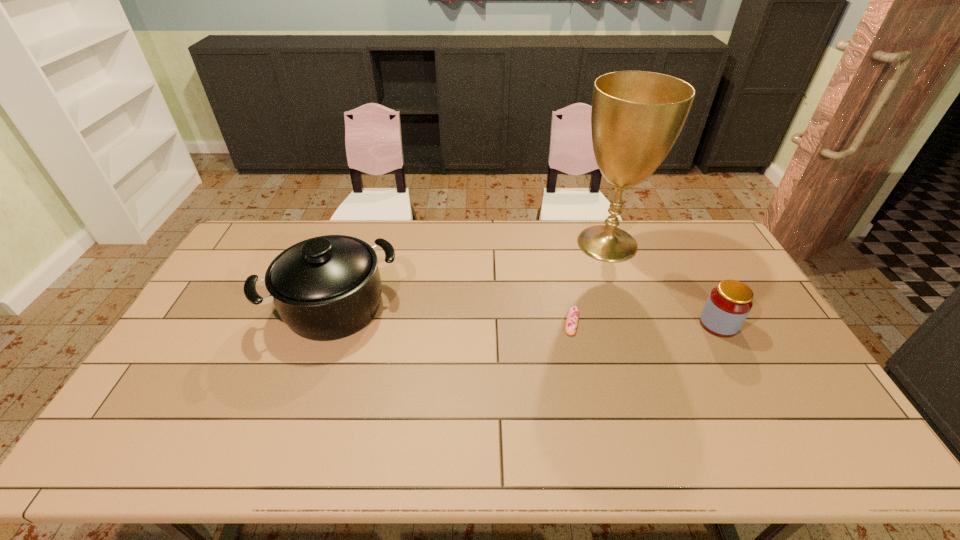
You are a GUI agent. You are given a task and a screenshot of the screen. Output one action in this format:
    pyautogui.click(x=<x>, y=<y>)
    Task: Click on the second object from right to left
    Image resolution: width=960 pixels, height=540 pixels.
    Given the screenshot: What is the action you would take?
    pyautogui.click(x=636, y=117)

Find the location of a particular element. the farthest object is located at coordinates click(636, 117).

The height and width of the screenshot is (540, 960). What are the coordinates of `the leftmost object` in the screenshot? It's located at (325, 288).

The height and width of the screenshot is (540, 960). I want to click on saucepan, so click(325, 288).

Locate an element on the screen. the third tallest object is located at coordinates (729, 303).

At what (x,y) coordinates should I click in order to perform the action: click on jar. Please return your answer as a coordinate pair (x, y). The image size is (960, 540). Looking at the image, I should click on (729, 303).

The width and height of the screenshot is (960, 540). Find the location of `the shortest object`. the shortest object is located at coordinates (572, 317).

Where is `eclair`? This screenshot has height=540, width=960. eclair is located at coordinates (572, 317).

Locate an element on the screen. free point located on the right of the tallest object is located at coordinates (683, 244).

Find the location of a particular element. This screenshot has height=540, width=960. free spot located on the back of the leftmost object is located at coordinates (356, 241).